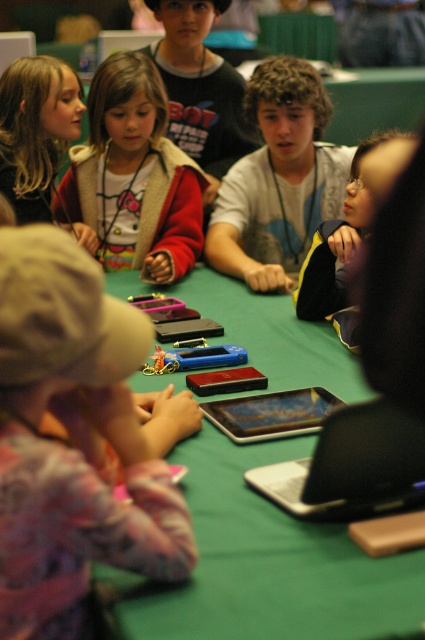
You are a photographer trying to capture a clear shot of the silver metallic laptop at center without any obstructions. Given that the matte white hoodie at upper left is in the scene, can you confirm if the laptop is visible from your current angle?

The silver metallic laptop at center is positioned under the matte white hoodie at upper left, meaning the hoodie is blocking the view of the laptop from the current angle. Therefore, the laptop might not be fully visible unless the hoodie is moved or the angle is adjusted.